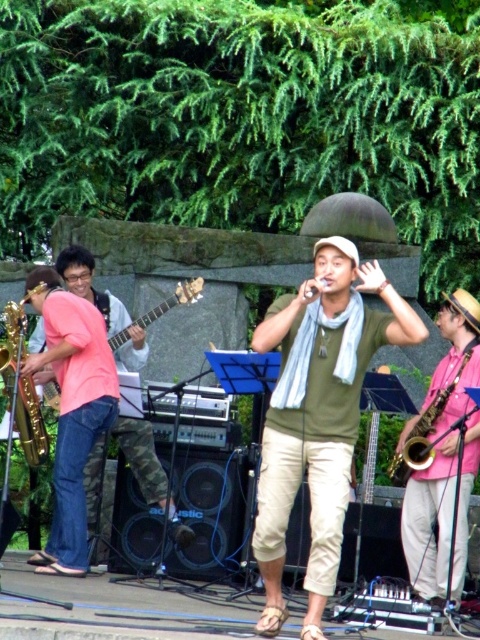
Question: Does pink matte saxophone at right have a greater width compared to satin gold saxophone at left?

Choices:
 (A) no
 (B) yes

Answer: (B)

Question: In this image, where is green matte shirt at center located relative to satin gold saxophone at left?

Choices:
 (A) left
 (B) right

Answer: (B)

Question: Based on their relative distances, which object is nearer to the satin gold saxophone at left?

Choices:
 (A) pink matte saxophone at right
 (B) green matte shirt at center

Answer: (B)

Question: Is satin gold saxophone at left positioned in front of matte pink guitar at left?

Choices:
 (A) yes
 (B) no

Answer: (A)

Question: Considering the real-world distances, which object is farthest from the matte pink guitar at left?

Choices:
 (A) satin gold saxophone at left
 (B) green matte shirt at center

Answer: (B)

Question: Which object appears farthest from the camera in this image?

Choices:
 (A) matte pink guitar at left
 (B) green matte shirt at center

Answer: (A)